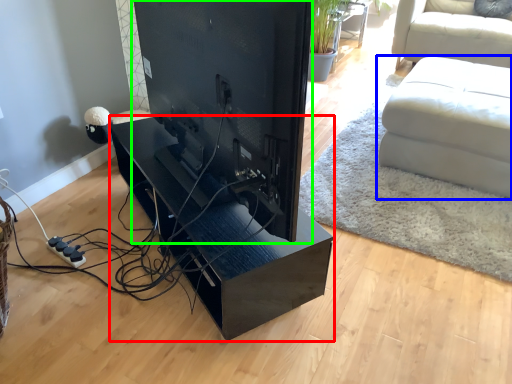
Question: Which object is positioned closest to table (highlighted by a red box)? Select from studio couch (highlighted by a blue box) and desktop computer (highlighted by a green box).

Choices:
 (A) studio couch
 (B) desktop computer

Answer: (B)